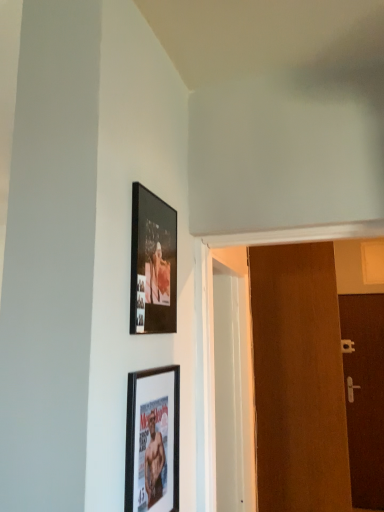
Question: Is matte black picture frame at lower center, marked as the 2th picture frame in a top-to-bottom arrangement, touching brown matte door at right, which appears as the second door when viewed from the left?

Choices:
 (A) yes
 (B) no

Answer: (B)

Question: Can you confirm if matte black picture frame at lower center, which is the first picture frame in bottom-to-top order, is shorter than brown matte door at right, which appears as the second door when viewed from the left?

Choices:
 (A) yes
 (B) no

Answer: (A)

Question: Is matte black picture frame at lower center, which is the first picture frame in bottom-to-top order, at the left side of brown matte door at right, arranged as the 1th door when viewed from the back?

Choices:
 (A) yes
 (B) no

Answer: (A)

Question: From the image's perspective, would you say matte black picture frame at lower center, marked as the 2th picture frame in a top-to-bottom arrangement, is shown under brown matte door at right, arranged as the 1th door when viewed from the back?

Choices:
 (A) no
 (B) yes

Answer: (A)

Question: From a real-world perspective, is matte black picture frame at lower center, marked as the 2th picture frame in a top-to-bottom arrangement, positioned above or below matte black picture frame at upper center, placed as the 1th picture frame when sorted from top to bottom?

Choices:
 (A) above
 (B) below

Answer: (B)

Question: Considering their positions, is matte black picture frame at lower center, which is the first picture frame in bottom-to-top order, located in front of or behind matte black picture frame at upper center, the 2th picture frame in the bottom-to-top sequence?

Choices:
 (A) behind
 (B) front

Answer: (B)

Question: Considering the positions of matte black picture frame at lower center, marked as the 2th picture frame in a top-to-bottom arrangement, and matte black picture frame at upper center, the 2th picture frame in the bottom-to-top sequence, in the image, is matte black picture frame at lower center, marked as the 2th picture frame in a top-to-bottom arrangement, taller or shorter than matte black picture frame at upper center, the 2th picture frame in the bottom-to-top sequence,?

Choices:
 (A) short
 (B) tall

Answer: (B)

Question: Considering the relative positions of matte black picture frame at lower center, which is the first picture frame in bottom-to-top order, and matte black picture frame at upper center, placed as the 1th picture frame when sorted from top to bottom, in the image provided, is matte black picture frame at lower center, which is the first picture frame in bottom-to-top order, to the left or to the right of matte black picture frame at upper center, placed as the 1th picture frame when sorted from top to bottom,?

Choices:
 (A) left
 (B) right

Answer: (B)

Question: Is brown matte door at right, the first door positioned from the right, bigger or smaller than matte black picture frame at lower center, marked as the 2th picture frame in a top-to-bottom arrangement?

Choices:
 (A) big
 (B) small

Answer: (A)

Question: Visually, is brown matte door at right, the first door positioned from the right, positioned to the left or to the right of matte black picture frame at lower center, marked as the 2th picture frame in a top-to-bottom arrangement?

Choices:
 (A) left
 (B) right

Answer: (B)

Question: Is brown matte door at right, arranged as the 1th door when viewed from the back, taller or shorter than matte black picture frame at lower center, marked as the 2th picture frame in a top-to-bottom arrangement?

Choices:
 (A) short
 (B) tall

Answer: (B)

Question: From a real-world perspective, is brown matte door at right, positioned as the second door in front-to-back order, physically located above or below matte black picture frame at lower center, marked as the 2th picture frame in a top-to-bottom arrangement?

Choices:
 (A) above
 (B) below

Answer: (B)

Question: Choose the correct answer: Is brown matte door at right, which appears as the second door when viewed from the left, inside matte black picture frame at upper center, placed as the 1th picture frame when sorted from top to bottom, or outside it?

Choices:
 (A) outside
 (B) inside

Answer: (A)

Question: From a real-world perspective, is brown matte door at right, which appears as the second door when viewed from the left, physically located above or below matte black picture frame at upper center, placed as the 1th picture frame when sorted from top to bottom?

Choices:
 (A) above
 (B) below

Answer: (B)